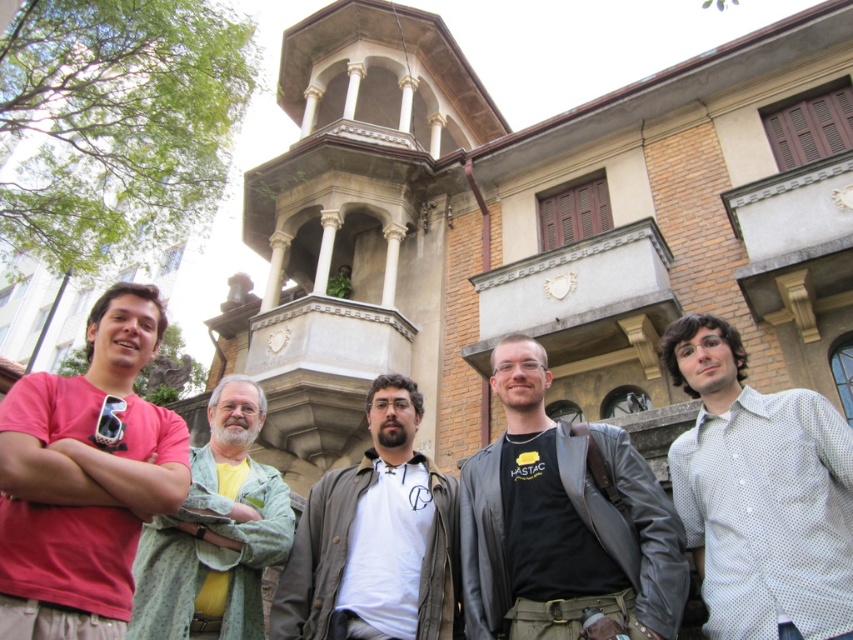
You are a photographer trying to capture a group photo of the white dotted shirt at right and the green textured shirt at left. Since you want to ensure both are visible, you need to adjust the camera angle. Which person should you position closer to the camera to make them appear the same height in the photo?

The white dotted shirt at right is taller than the green textured shirt at left. To make them appear the same height in the photo, you should position the green textured shirt at left closer to the camera.

From the picture: You are a photographer trying to capture a photo of the group in front of the historic building. You notice the white dotted shirt at right and the green textured shirt at left. Which person should you focus on to ensure their shirt is visible in the frame if the camera can only capture the highest part of the group?

The white dotted shirt at right is above the green textured shirt at left, so focusing on the white dotted shirt at right will ensure it is visible in the frame as it is positioned higher up.

You are a photographer positioned 10 meters away from the historic building. You want to take a photo that includes both the matte pink shirt at center and the white matte shirt at center. Can you fit both into your camera frame if your camera has a maximum field of view that can capture objects within a 10 meter span?

The distance between the matte pink shirt at center and the white matte shirt at center is 9.00 meters. Since your camera can capture up to 10 meters, you can fit both into the frame as the distance between them is within the camera field of view.